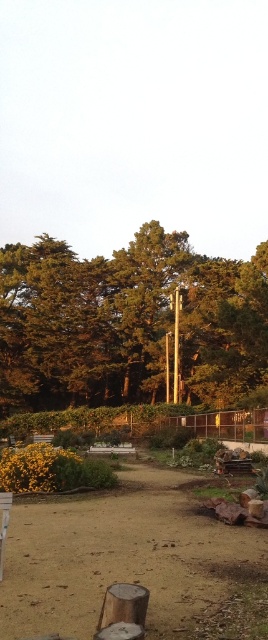
Looking at this image, you are standing in a park and see the green leafy tree at center. If you want to walk towards it, how many steps would you estimate to reach it, assuming each step covers about 0.76 meters?

The green leafy tree at center is 32.86 meters away. Dividing the distance by the step length of 0.76 meters gives approximately 43 steps. Therefore, you would need about 43 steps to reach the green leafy tree at center.

From the picture: You are standing on the brown sandy dirt at center in the park. You want to walk to the green leafy tree at center. Is the tree directly above you or in front of you?

The green leafy tree at center is positioned over brown sandy dirt at center, so the tree is directly above you.

You are standing at the entrance of the sandy pathway and see the green leafy tree at center and the brown sandy dirt at center. Which object is positioned to the left of the other?

The green leafy tree at center is to the left of the brown sandy dirt at center.